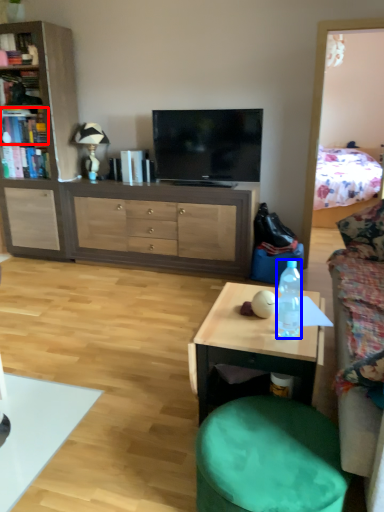
Question: Which of the following is the closest to the observer, book (highlighted by a red box) or bottle (highlighted by a blue box)?

Choices:
 (A) book
 (B) bottle

Answer: (B)